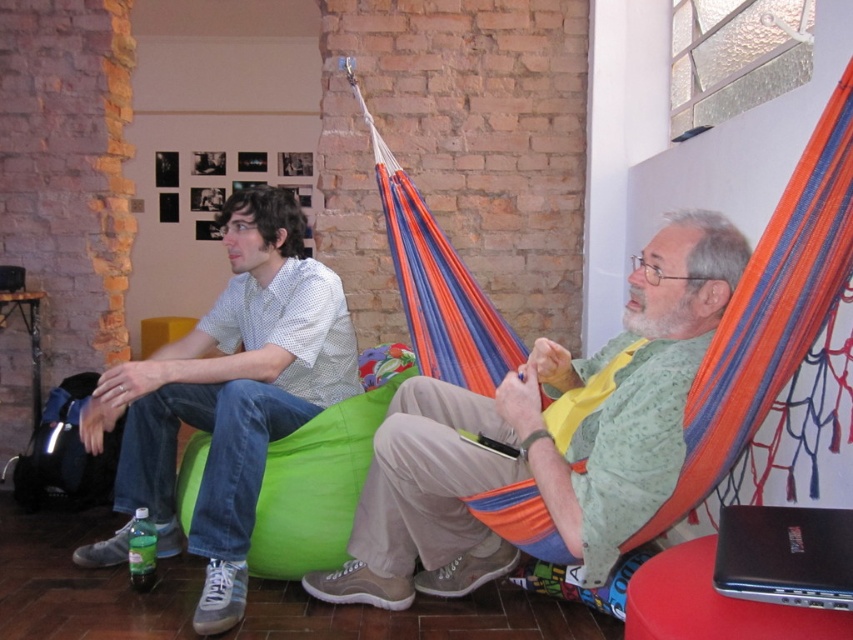
You are standing in the room and want to move from the green fabric bean bag at lower left to the black plastic laptop at lower right. Is the laptop to your right or left side when facing the direction of movement?

The black plastic laptop at lower right is to your right side when moving from the green fabric bean bag at lower left because the green fabric bean bag at lower left is positioned to the left of the black plastic laptop at lower right.

You are standing in the room and want to reach the point marked at coordinates (x=367, y=460). The room has a total area of 10 square meters. Can you estimate whether the point is closer to the center of the room or near the edge?

The point marked at coordinates (x=367, y=460) is 2.65 meters from the viewer. Without knowing the exact dimensions of the room or the viewer position, it is impossible to accurately determine if it is closer to the center or the edge. The room area being 10 square meters only provides a rough estimate of space but not specific positioning.

You are a photographer setting up a shoot in the room. You need to place a new tripod between the matte white shirt at left and the black plastic laptop at lower right. Based on their positions, which side of the laptop should the tripod be placed to ensure it aligns with the existing arrangement?

The matte white shirt at left is positioned on the left side of black plastic laptop at lower right, so placing the tripod to the left of the laptop would maintain alignment with the existing arrangement.